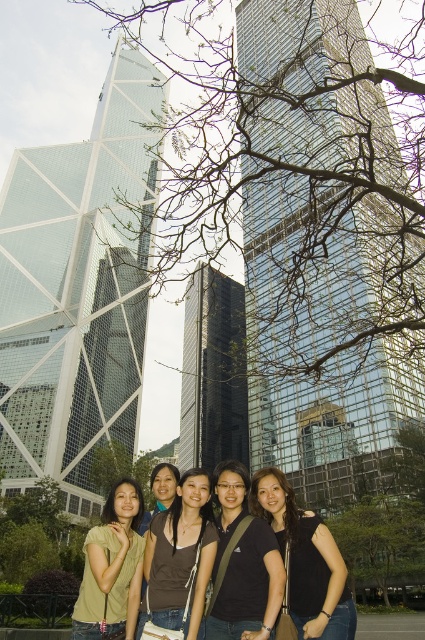
Question: Is black matte tank top at lower center bigger than light green t-shirt at center?

Choices:
 (A) no
 (B) yes

Answer: (A)

Question: Which object is positioned closest to the black matte tank top at lower center?

Choices:
 (A) black matte shirt at center
 (B) light green t-shirt at center
 (C) brown fabric shirt at center

Answer: (A)

Question: Does black matte shirt at center lie behind black matte tank top at lower center?

Choices:
 (A) yes
 (B) no

Answer: (B)

Question: Among these objects, which one is farthest from the camera?

Choices:
 (A) light green t-shirt at center
 (B) black matte shirt at center

Answer: (A)

Question: Is black matte tank top at lower center to the left of light green t-shirt at center from the viewer's perspective?

Choices:
 (A) no
 (B) yes

Answer: (A)

Question: Which point is farther to the camera?

Choices:
 (A) black matte tank top at lower center
 (B) light green t-shirt at center
 (C) black matte shirt at center

Answer: (B)